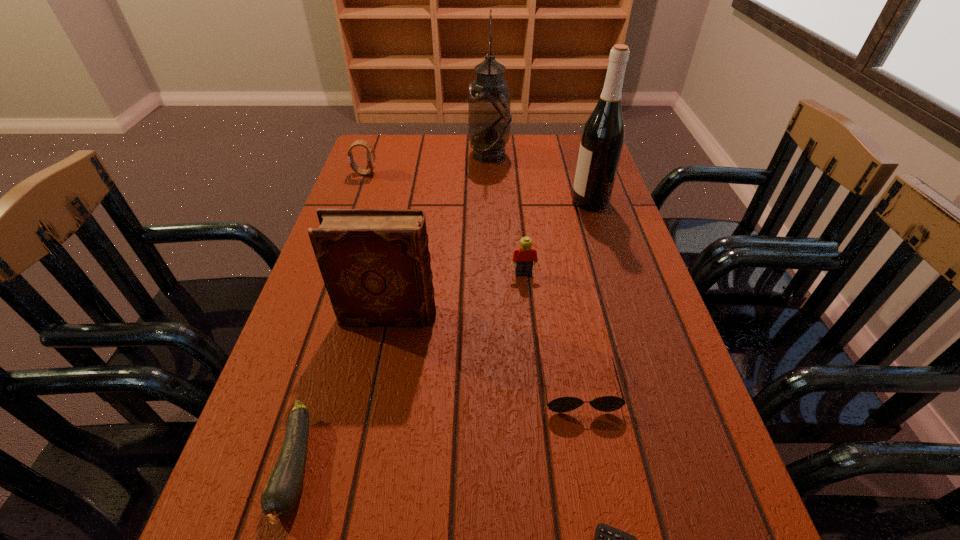
Point out which object is positioned as the nearest to the Lego. Please provide its 2D coordinates. Your answer should be formatted as a tuple, i.e. [(x, y)], where the tuple contains the x and y coordinates of a point satisfying the conditions above.

[(375, 263)]